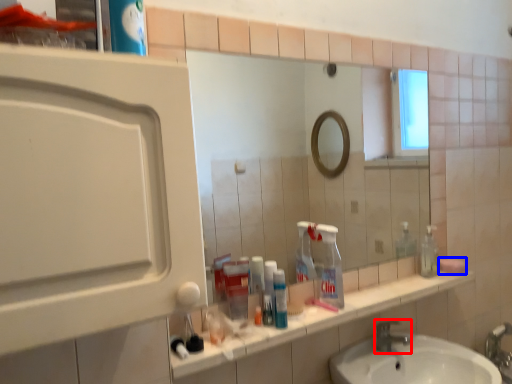
Question: Which of the following is the closest to the observer, tap (highlighted by a red box) or soap (highlighted by a blue box)?

Choices:
 (A) tap
 (B) soap

Answer: (A)